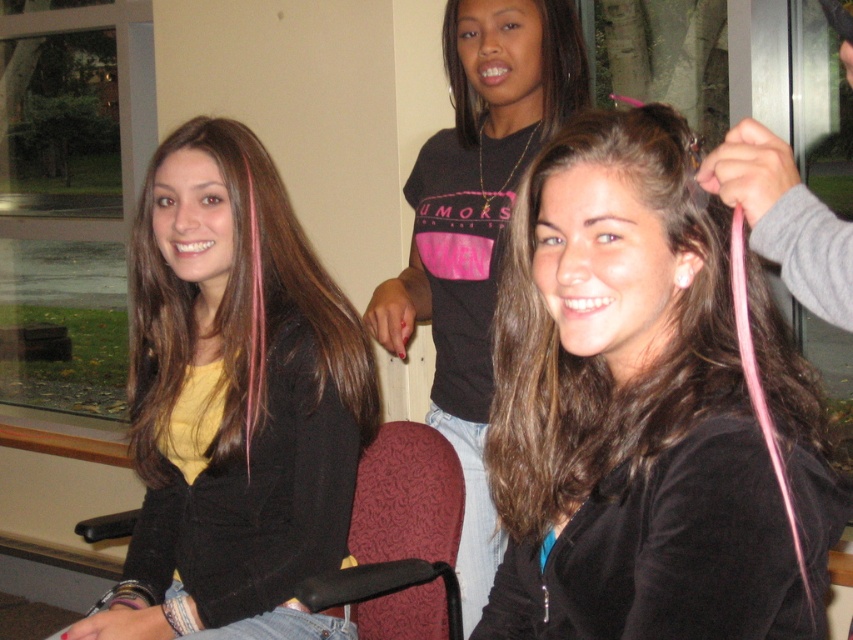
You are taking a photo of the scene described. You want to focus on the person holding an object at point (474, 380) and the other person at point (358, 563). Which of these two points should you focus on first to ensure the closer one is in focus?

You should focus on point (474, 380) first because it is closer to the camera than point (358, 563).

You are standing in the scene and want to locate the matte black shirt at upper center. What are its coordinates?

The coordinates of the matte black shirt at upper center are at point (477, 227).